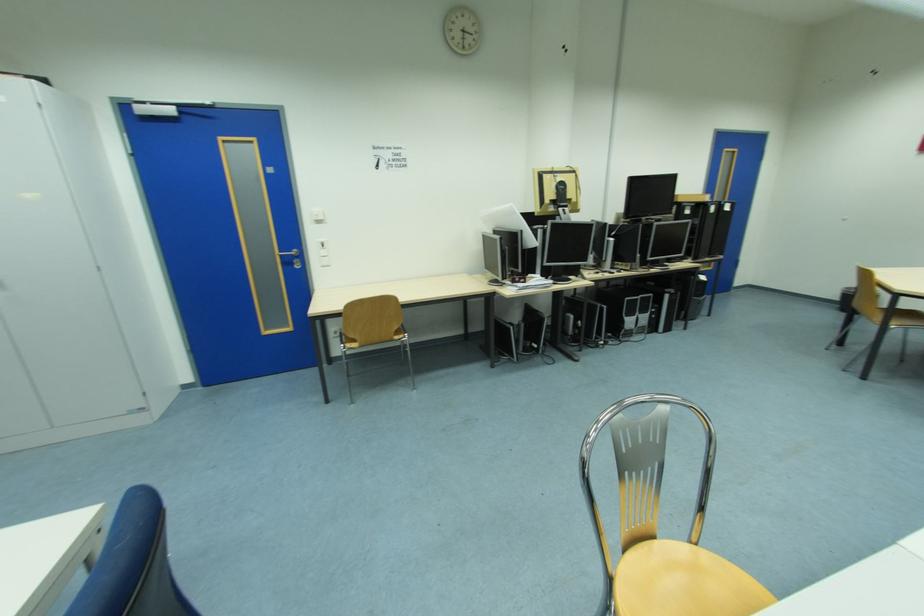
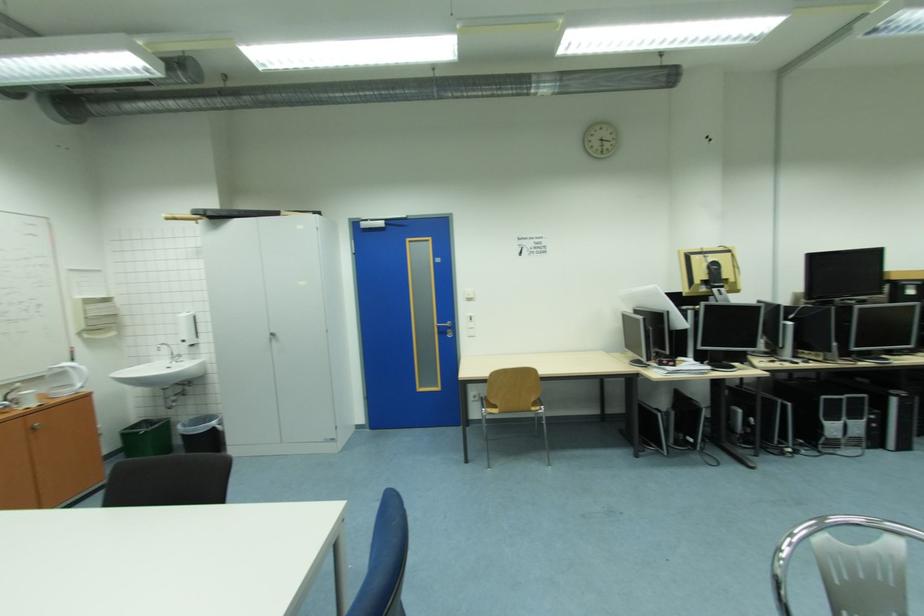
The point at (492, 238) is marked in the first image. Where is the corresponding point in the second image?

(631, 318)